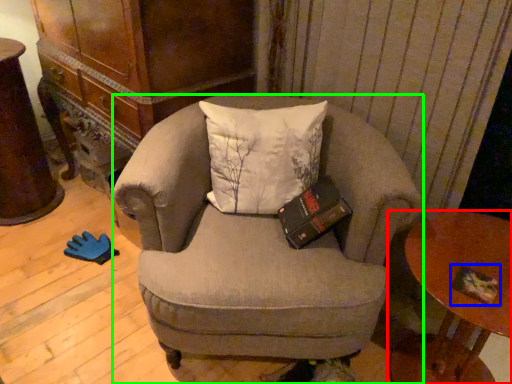
Question: Which is nearer to the table (highlighted by a red box)? paperback book (highlighted by a blue box) or chair (highlighted by a green box).

Choices:
 (A) paperback book
 (B) chair

Answer: (A)